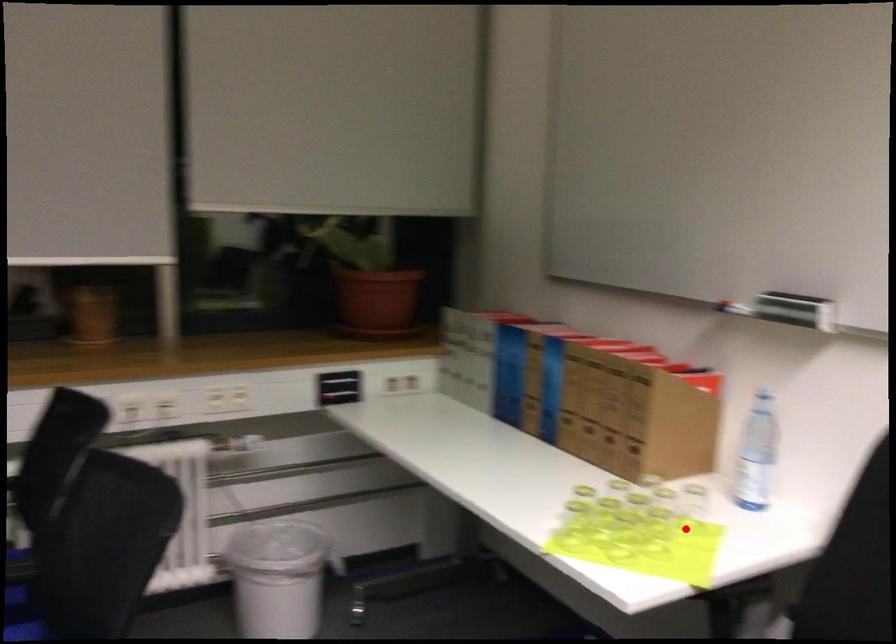
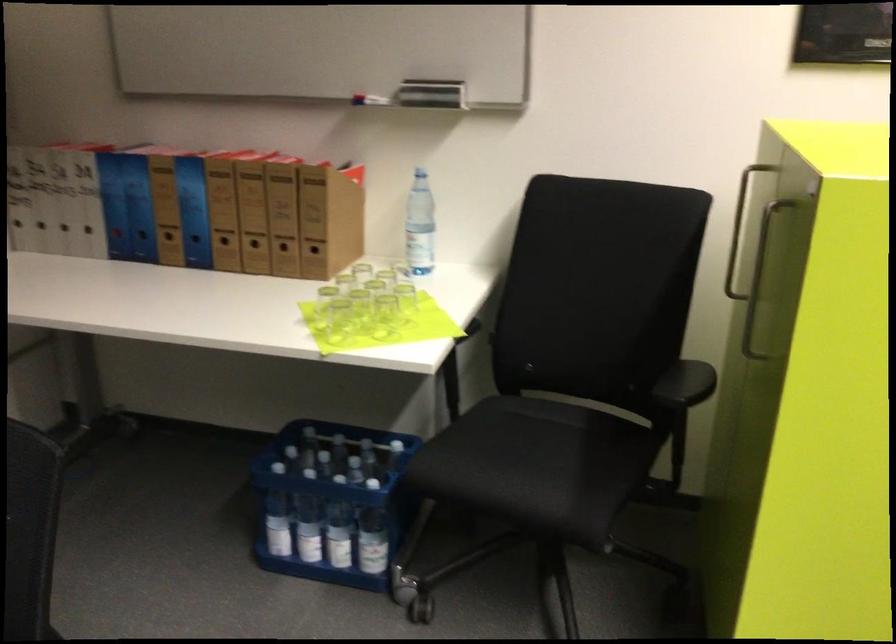
Question: I am providing you with two images of the same scene from different viewpoints. A red point is shown in image1. For the corresponding object point in image2, is it positioned nearer or farther from the camera?

Choices:
 (A) Nearer
 (B) Farther

Answer: (B)